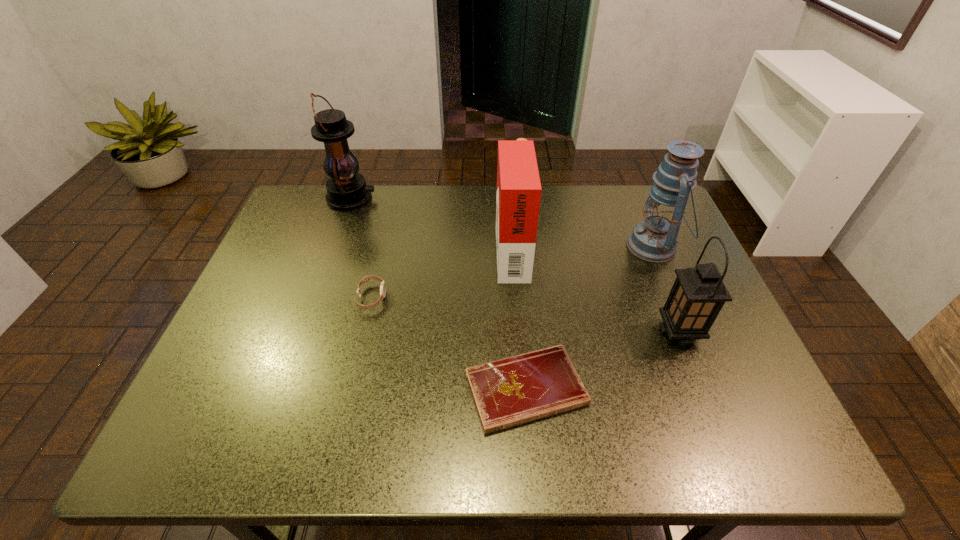
You are a GUI agent. You are given a task and a screenshot of the screen. Output one action in this format:
    pyautogui.click(x=<x>, y=<y>)
    Task: Click on the cigarette case that is at the far edge
    Image resolution: width=960 pixels, height=540 pixels.
    Given the screenshot: What is the action you would take?
    pyautogui.click(x=518, y=197)

Identify the location of object positioned at the near edge. The height and width of the screenshot is (540, 960). click(509, 392).

Locate an element on the screen. The image size is (960, 540). object that is at the left edge is located at coordinates (346, 189).

Identify the location of object situated at the far left corner. (346, 189).

Where is `object that is at the far right corner`? This screenshot has width=960, height=540. object that is at the far right corner is located at coordinates (655, 239).

Locate an element on the screen. vacant point at the far edge is located at coordinates (461, 226).

This screenshot has height=540, width=960. Find the location of `free space at the near edge of the desktop`. free space at the near edge of the desktop is located at coordinates (358, 440).

At what (x,y) coordinates should I click in order to perform the action: click on free spot at the left edge of the desktop. Please return your answer as a coordinate pair (x, y). Looking at the image, I should click on (308, 295).

The image size is (960, 540). I want to click on empty space between the fifth object from right to left and the farthest lantern, so click(361, 248).

Identify the location of unoccupied position between the cigarette case and the farthest object. click(x=431, y=224).